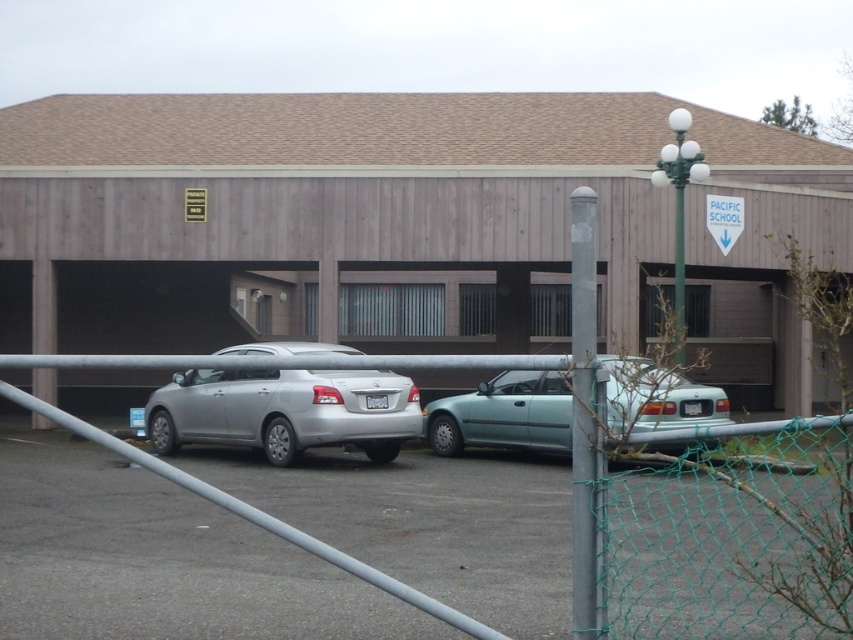
Describe the element at coordinates (323, 220) in the screenshot. I see `wooden paneling parking garage at center` at that location.

This screenshot has width=853, height=640. Identify the location of wooden paneling parking garage at center. (323, 220).

The width and height of the screenshot is (853, 640). Describe the element at coordinates (252, 515) in the screenshot. I see `green chain-link fence at lower right` at that location.

Based on the photo, which of these two, green chain-link fence at lower right or light blue matte car at center, stands taller?

green chain-link fence at lower right

Who is more forward, (259, 358) or (643, 387)?

Point (643, 387) is more forward.

In order to click on green chain-link fence at lower right in this screenshot , I will do `click(252, 515)`.

Who is positioned more to the right, light blue matte car at center or white plastic sign at upper center?

white plastic sign at upper center is more to the right.

Is light blue matte car at center above white plastic sign at upper center?

No.

Does point (426, 419) come farther from viewer compared to point (738, 218)?

No.

Identify the location of light blue matte car at center. (503, 413).